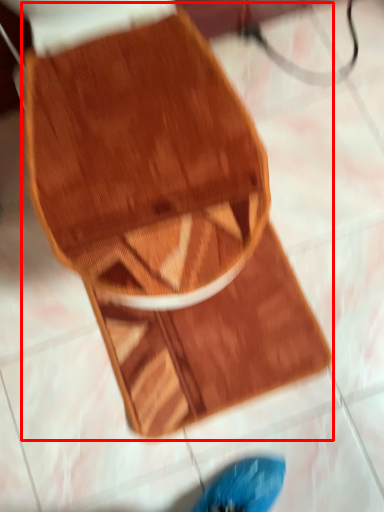
Question: Observing the image, what is the correct spatial positioning of footwear (annotated by the red box) in reference to mat?

Choices:
 (A) left
 (B) right

Answer: (B)